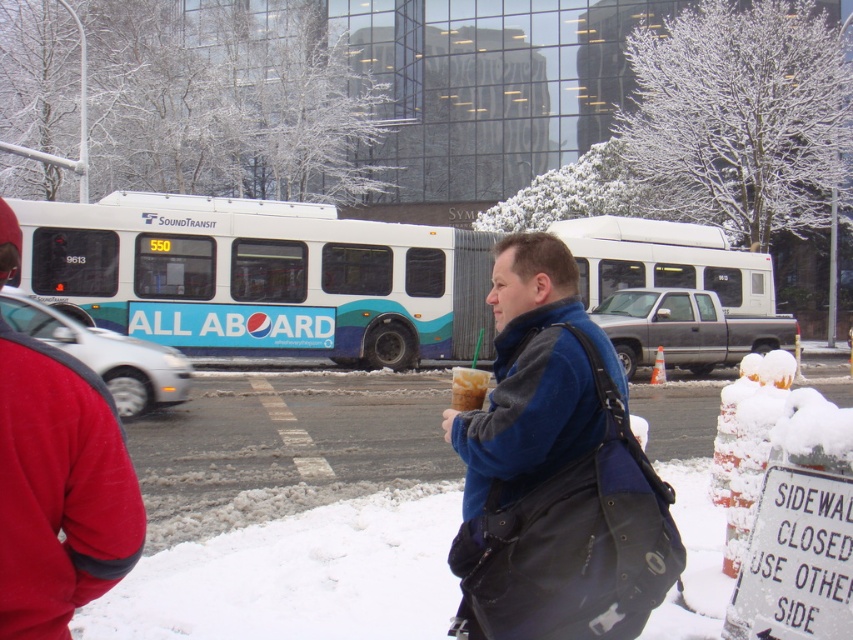
You are a fashion designer observing the winter scene. You notice two jackets, the blue fleece jacket at center and the red fleece jacket at left. Which jacket would you recommend for a client who prefers a more voluminous style?

The blue fleece jacket at center is larger in size compared to the red fleece jacket at left, so it would be the better choice for someone preferring a more voluminous style.

You are standing at the point with coordinates point (105, 522) and want to walk to the point with coordinates point (595, 384). According to the scene, which direction should you move to reach your destination?

You should move backward because point (595, 384) is behind point (105, 522).